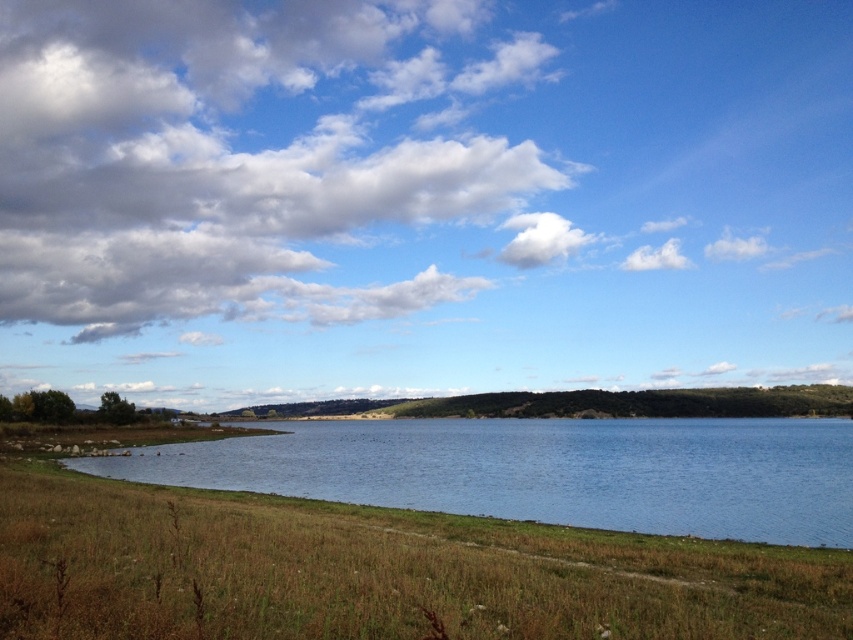
Question: Is dry grass at lower center closer to the viewer compared to white fluffy cloud at upper center?

Choices:
 (A) yes
 (B) no

Answer: (A)

Question: Which point appears farthest from the camera in this image?

Choices:
 (A) (746, 518)
 (B) (195, 618)

Answer: (A)

Question: Is dry grass at lower center positioned behind blue water at center?

Choices:
 (A) yes
 (B) no

Answer: (B)

Question: Estimate the real-world distances between objects in this image. Which object is farther from the blue water at center?

Choices:
 (A) white fluffy cloud at upper center
 (B) dry grass at lower center

Answer: (A)

Question: Which object appears farthest from the camera in this image?

Choices:
 (A) dry grass at lower center
 (B) blue water at center

Answer: (B)

Question: Can you confirm if dry grass at lower center is positioned above blue water at center?

Choices:
 (A) yes
 (B) no

Answer: (A)